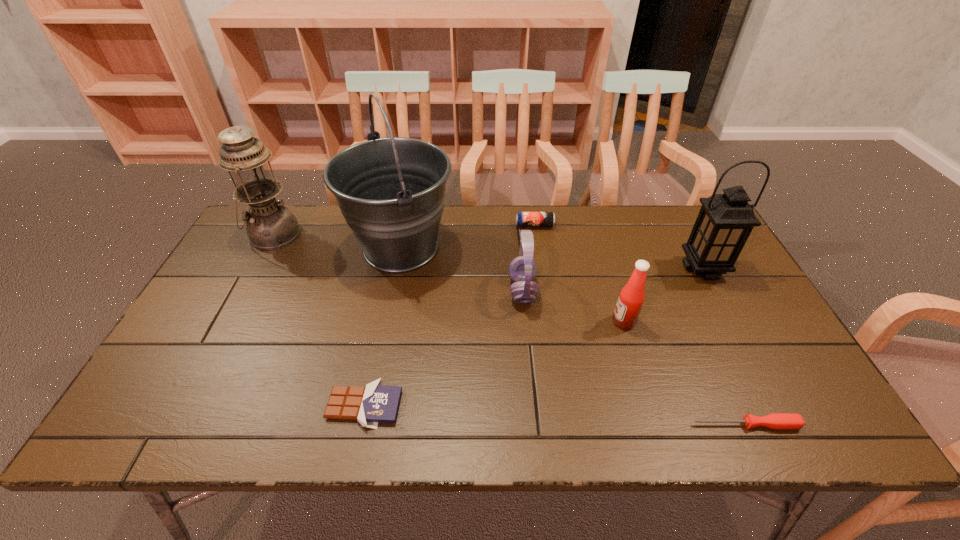
Where is `bucket`? bucket is located at coordinates (391, 191).

Locate an element on the screen. oil lamp is located at coordinates (270, 225).

Locate an element on the screen. This screenshot has height=540, width=960. lantern is located at coordinates (725, 221).

Where is `the third object from right to left`? the third object from right to left is located at coordinates (631, 298).

Identify the location of headset. Image resolution: width=960 pixels, height=540 pixels. (522, 269).

You are a GUI agent. You are given a task and a screenshot of the screen. Output one action in this format:
    pyautogui.click(x=<x>, y=<y>)
    Task: Click on the beer can
    
    Given the screenshot: What is the action you would take?
    pyautogui.click(x=523, y=219)

What are the coordinates of `screwdriver` in the screenshot? It's located at (782, 421).

In order to click on chocolate bar in this screenshot , I will do pyautogui.click(x=374, y=403).

Where is `vacant region located on the left of the bucket`? vacant region located on the left of the bucket is located at coordinates (298, 248).

Identify the location of vacant space situated on the front of the leftmost object. This screenshot has height=540, width=960. (228, 320).